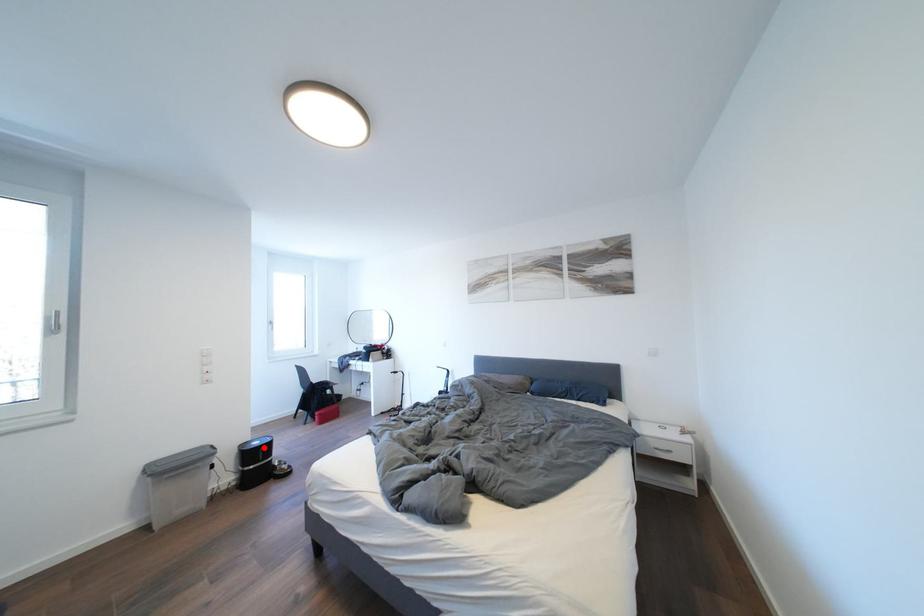
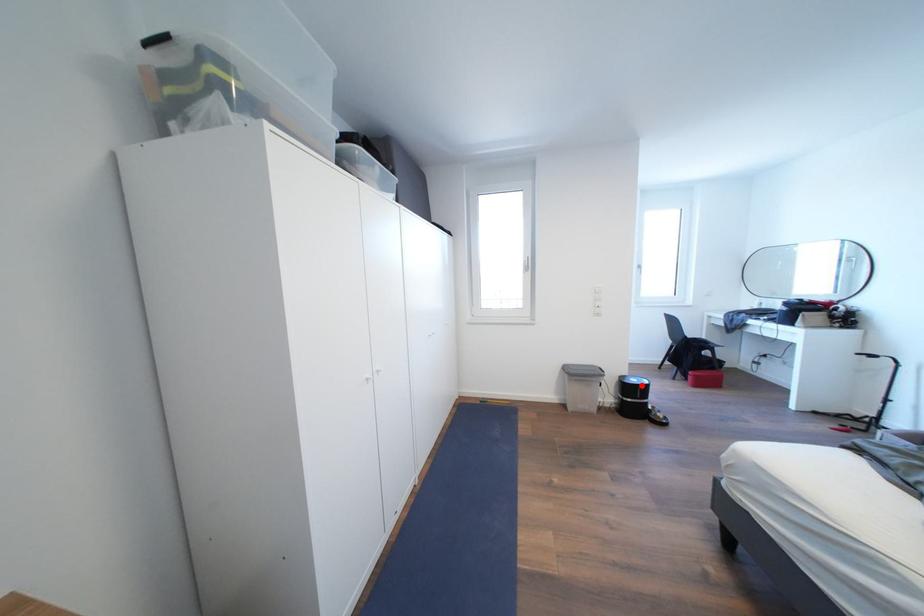
I am providing you with two images of the same scene from different viewpoints. A red point is marked on the first image and another point is marked on the second image. Does the point marked in image1 correspond to the same location as the one in image2?

Yes